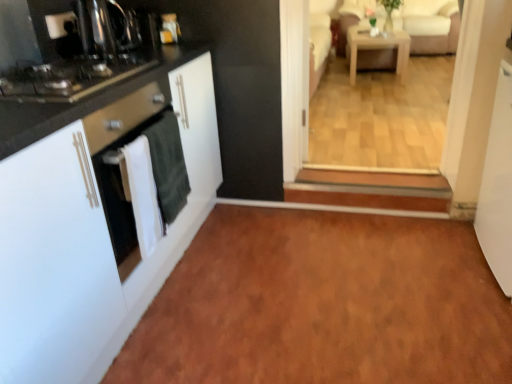
Question: Is light wood/wooden table at center wider than beige fabric couch at upper right?

Choices:
 (A) yes
 (B) no

Answer: (B)

Question: Does light wood/wooden table at center have a smaller size compared to beige fabric couch at upper right?

Choices:
 (A) no
 (B) yes

Answer: (B)

Question: Does light wood/wooden table at center turn towards beige fabric couch at upper right?

Choices:
 (A) no
 (B) yes

Answer: (A)

Question: Is light wood/wooden table at center facing away from beige fabric couch at upper right?

Choices:
 (A) no
 (B) yes

Answer: (B)

Question: Can you confirm if light wood/wooden table at center is thinner than beige fabric couch at upper right?

Choices:
 (A) yes
 (B) no

Answer: (A)

Question: From a real-world perspective, relative to light wood/wooden table at center, is black glass stove at left vertically above or below?

Choices:
 (A) below
 (B) above

Answer: (B)

Question: Is black glass stove at left in front of or behind light wood/wooden table at center in the image?

Choices:
 (A) front
 (B) behind

Answer: (A)

Question: From the image's perspective, is black glass stove at left above or below light wood/wooden table at center?

Choices:
 (A) below
 (B) above

Answer: (A)

Question: In terms of height, does black glass stove at left look taller or shorter compared to light wood/wooden table at center?

Choices:
 (A) short
 (B) tall

Answer: (A)

Question: From a real-world perspective, is brown laminate floor at lower center above or below white matte cabinet at left?

Choices:
 (A) below
 (B) above

Answer: (A)

Question: In the image, is brown laminate floor at lower center positioned in front of or behind white matte cabinet at left?

Choices:
 (A) front
 (B) behind

Answer: (B)

Question: Is brown laminate floor at lower center wider or thinner than white matte cabinet at left?

Choices:
 (A) wide
 (B) thin

Answer: (A)

Question: Considering the positions of point (372, 299) and point (32, 349), is point (372, 299) closer or farther from the camera than point (32, 349)?

Choices:
 (A) farther
 (B) closer

Answer: (A)

Question: Is white matte cabinet at left bigger or smaller than black glass stove at left?

Choices:
 (A) small
 (B) big

Answer: (B)

Question: Is white matte cabinet at left spatially inside black glass stove at left, or outside of it?

Choices:
 (A) outside
 (B) inside

Answer: (A)